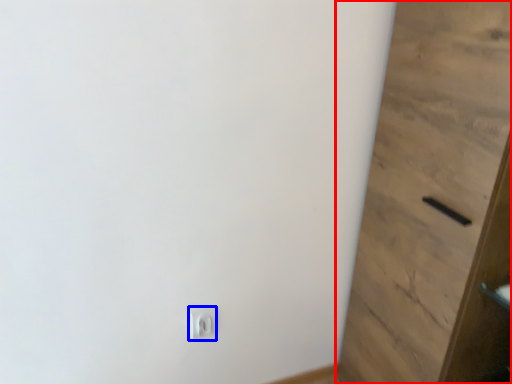
Question: Among these objects, which one is nearest to the camera, door (highlighted by a red box) or light switch (highlighted by a blue box)?

Choices:
 (A) door
 (B) light switch

Answer: (A)